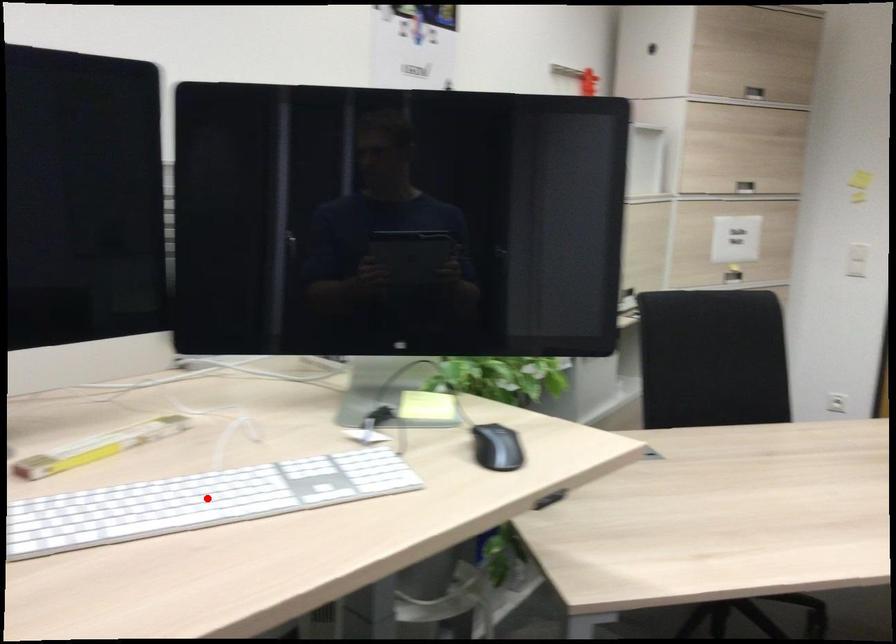
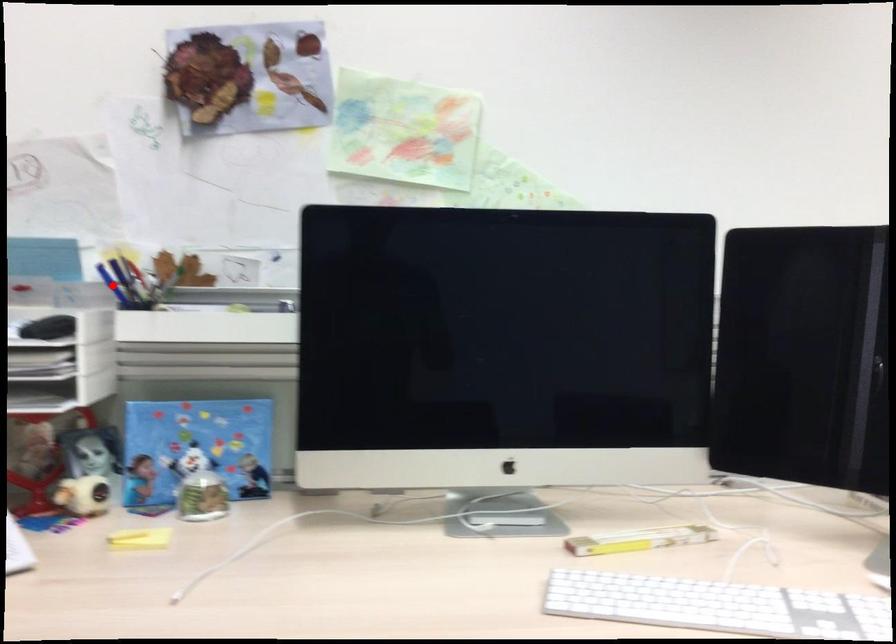
Based on the photo, I am providing you with two images of the same scene from different viewpoints. A red point is marked on the first image and another point is marked on the second image. Are the points marked in image1 and image2 representing the same 3D position?

No